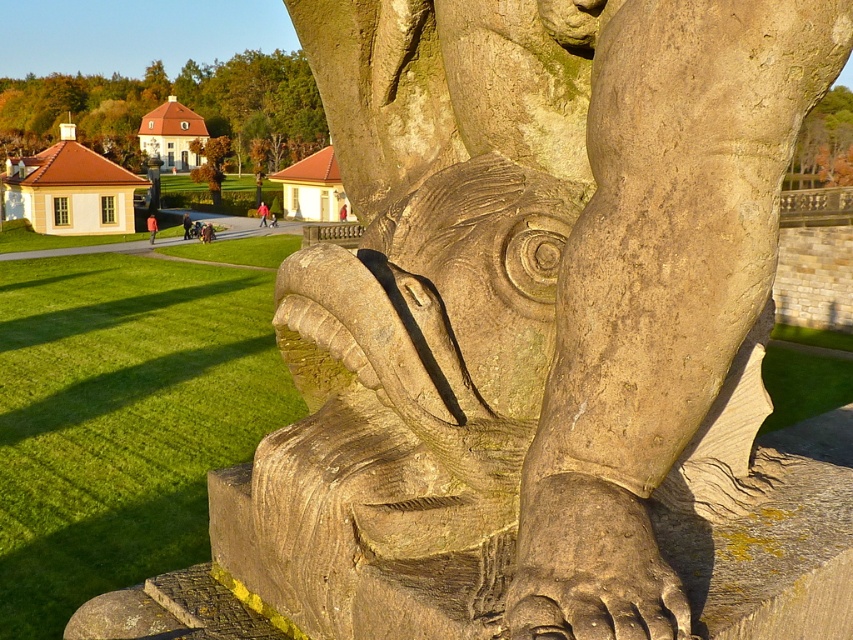
Question: Which point is farther to the camera?

Choices:
 (A) (216, 177)
 (B) (96, 106)
 (C) (822, 109)

Answer: (C)

Question: Can you confirm if brown rough bark at upper right is wider than green leafy tree at center?

Choices:
 (A) yes
 (B) no

Answer: (A)

Question: Which object is the closest to the brown rough bark at upper right?

Choices:
 (A) green leafy tree at center
 (B) green leafy tree at upper center

Answer: (A)

Question: Is the position of green leafy tree at upper center more distant than that of green leafy tree at center?

Choices:
 (A) yes
 (B) no

Answer: (B)

Question: Does green leafy tree at upper center appear over brown rough bark at upper right?

Choices:
 (A) yes
 (B) no

Answer: (A)

Question: Which point is closer to the camera?

Choices:
 (A) brown rough bark at upper right
 (B) green leafy tree at center
 (C) green leafy tree at upper center

Answer: (A)